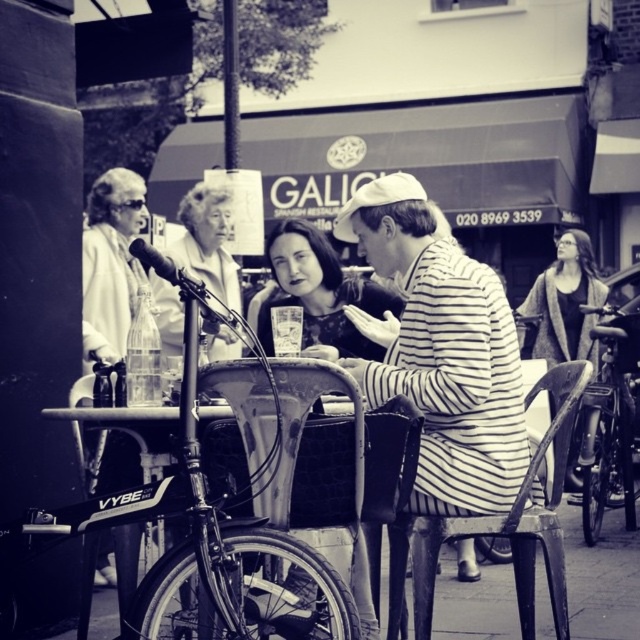
Is matte plastic cup at center above shiny metallic bicycle at right?

Yes.

The width and height of the screenshot is (640, 640). Describe the element at coordinates (320, 291) in the screenshot. I see `matte plastic cup at center` at that location.

I want to click on matte plastic cup at center, so coord(320,291).

Does point (388, 388) come in front of point (339, 289)?

Yes.

Can you confirm if striped fabric jacket at center is smaller than matte plastic cup at center?

No, striped fabric jacket at center is not smaller than matte plastic cup at center.

Is point (468, 499) positioned after point (326, 237)?

No, (468, 499) is closer to viewer.

This screenshot has height=640, width=640. Identify the location of striped fabric jacket at center. (440, 352).

Who is lower down, metallic stool at lower center or matte gray cardigan at center?

metallic stool at lower center is lower down.

Who is positioned more to the right, metallic stool at lower center or matte gray cardigan at center?

Positioned to the right is matte gray cardigan at center.

Locate an element on the screen. metallic stool at lower center is located at coordinates point(509,557).